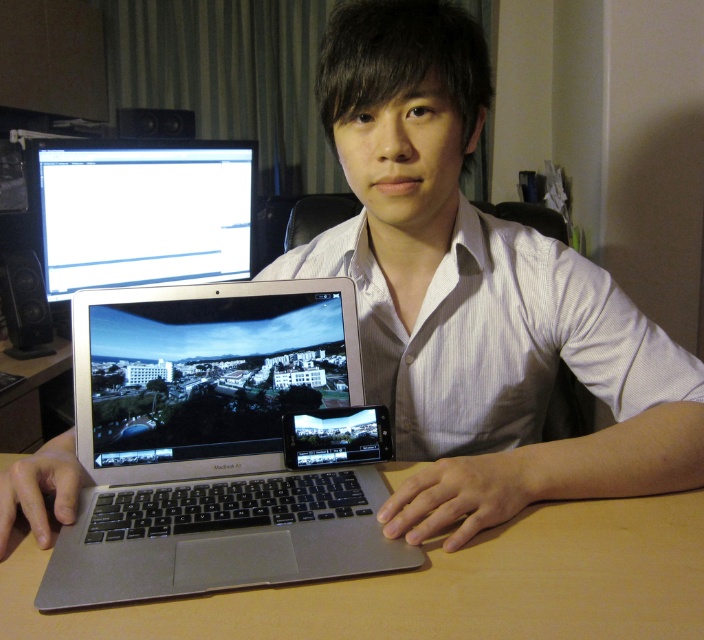
Question: Is silver metallic laptop at center wider than brown wooden table at center?

Choices:
 (A) yes
 (B) no

Answer: (B)

Question: Is silver metallic laptop at center thinner than brown wooden table at center?

Choices:
 (A) no
 (B) yes

Answer: (B)

Question: Which point is closer to the camera taking this photo?

Choices:
 (A) (272, 452)
 (B) (666, 554)
 (C) (206, 204)

Answer: (B)

Question: Which point is closer to the camera?

Choices:
 (A) (265, 630)
 (B) (180, 257)

Answer: (A)

Question: Can you confirm if silver metallic laptop at center is positioned above brown wooden table at center?

Choices:
 (A) yes
 (B) no

Answer: (A)

Question: Considering the real-world distances, which object is farthest from the brown wooden table at center?

Choices:
 (A) silver metallic laptop at center
 (B) white glossy monitor at upper left

Answer: (B)